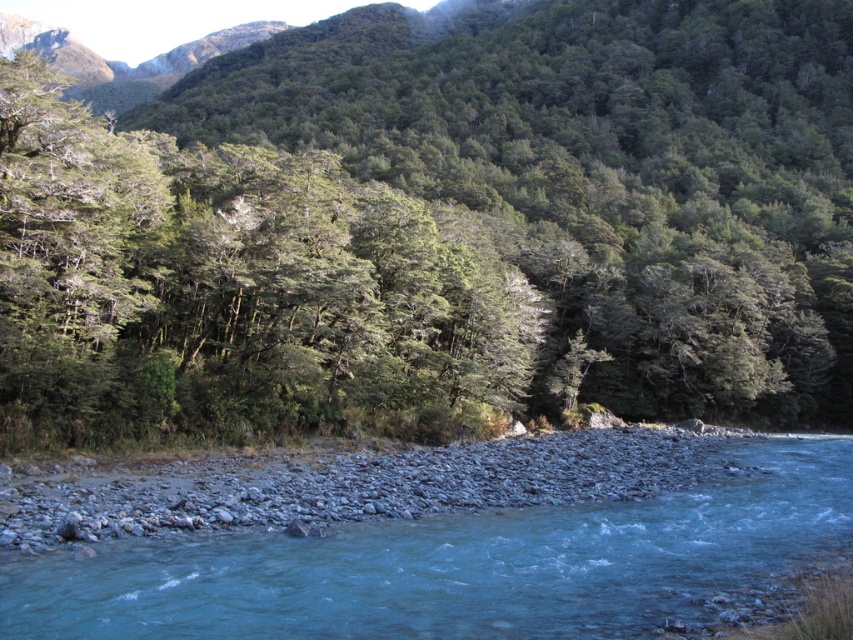
Does green leafy trees at center have a larger size compared to clear blue water at center?

Indeed, green leafy trees at center has a larger size compared to clear blue water at center.

This screenshot has width=853, height=640. What do you see at coordinates (437, 225) in the screenshot?
I see `green leafy trees at center` at bounding box center [437, 225].

Locate an element on the screen. This screenshot has width=853, height=640. green leafy trees at center is located at coordinates (437, 225).